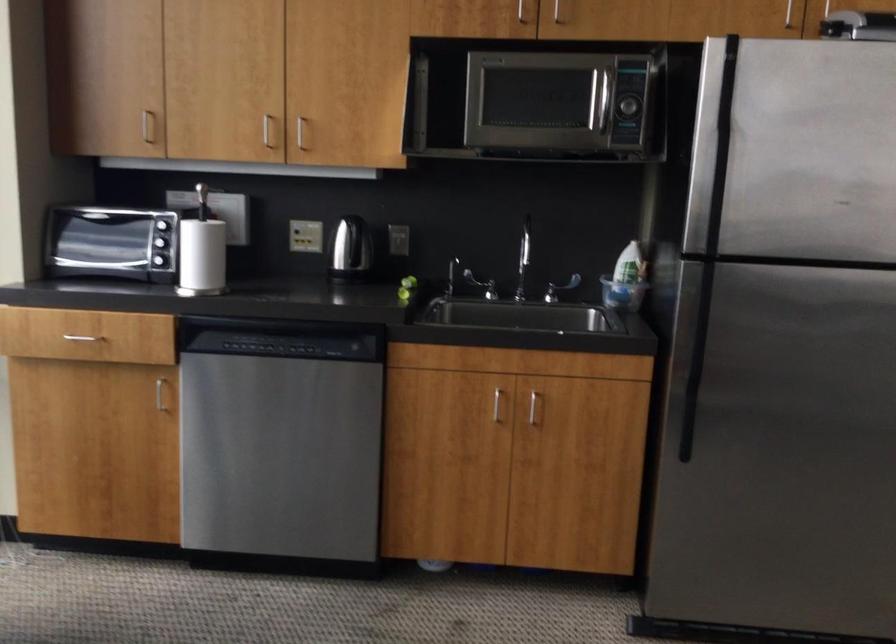
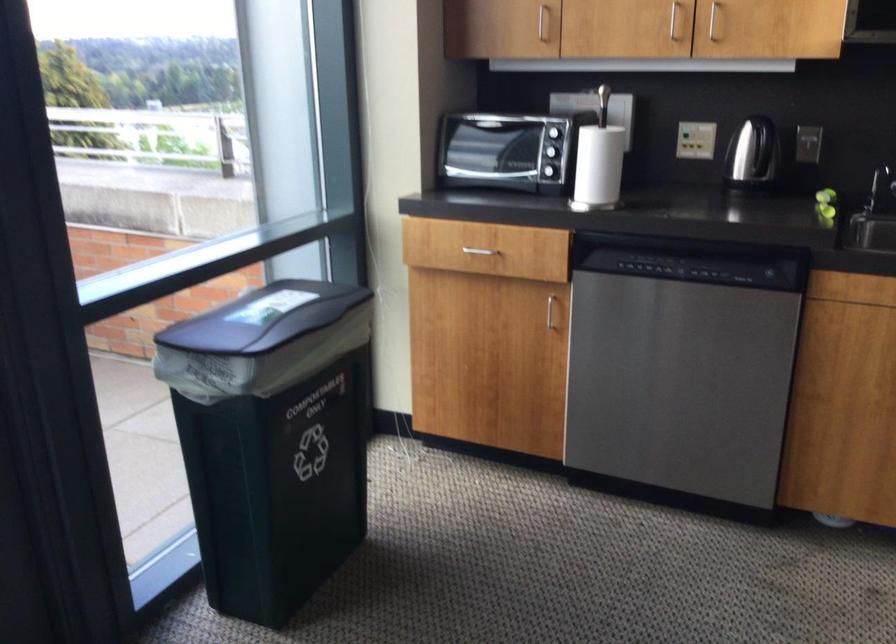
Locate, in the second image, the point that corresponds to (x=451, y=283) in the first image.

(879, 187)